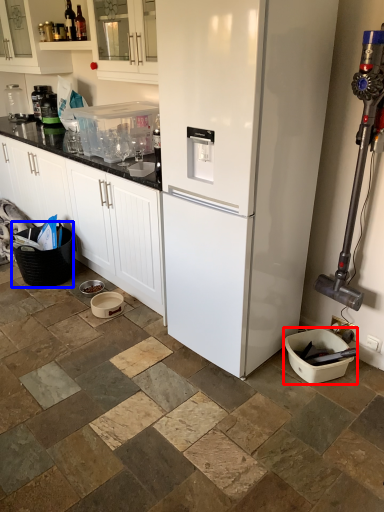
Question: Which object is further to the camera taking this photo, appliance (highlighted by a red box) or basket (highlighted by a blue box)?

Choices:
 (A) appliance
 (B) basket

Answer: (B)